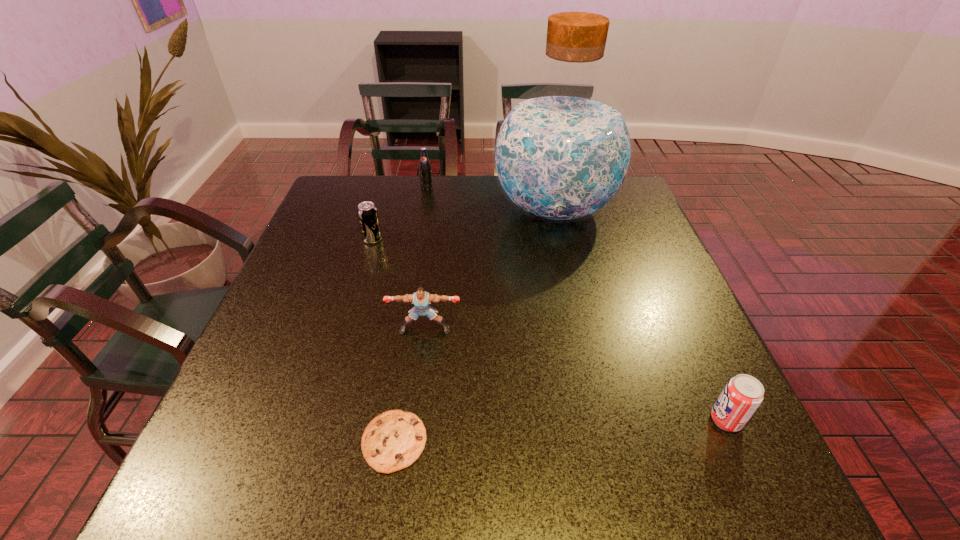
Image resolution: width=960 pixels, height=540 pixels. Identify the location of empty space that is in between the tallest object and the second nearest soda can. (464, 224).

At what (x,y) coordinates should I click in order to perform the action: click on free spot between the cookie and the second object from right to left. Please return your answer as a coordinate pair (x, y). Looking at the image, I should click on (474, 326).

Find the location of `unoccupied area between the puncher and the cookie`. unoccupied area between the puncher and the cookie is located at coordinates (410, 386).

Find the location of a particular element. The height and width of the screenshot is (540, 960). empty space between the shortest object and the puncher is located at coordinates pos(410,386).

Where is `free space between the second soda can from left to right and the rightmost soda can`? free space between the second soda can from left to right and the rightmost soda can is located at coordinates (576, 304).

The image size is (960, 540). I want to click on vacant area between the nearest soda can and the water jug, so click(x=640, y=315).

Find the location of `free spot between the second nearest soda can and the rightmost object`. free spot between the second nearest soda can and the rightmost object is located at coordinates (549, 330).

At what (x,y) coordinates should I click in order to perform the action: click on object that ranks as the second closest to the leftmost soda can. Please return your answer as a coordinate pair (x, y). The image size is (960, 540). Looking at the image, I should click on (421, 299).

Where is `object that is the fifth closest to the water jug`? The image size is (960, 540). object that is the fifth closest to the water jug is located at coordinates (393, 440).

The width and height of the screenshot is (960, 540). I want to click on soda can that is the second closest to the water jug, so click(367, 212).